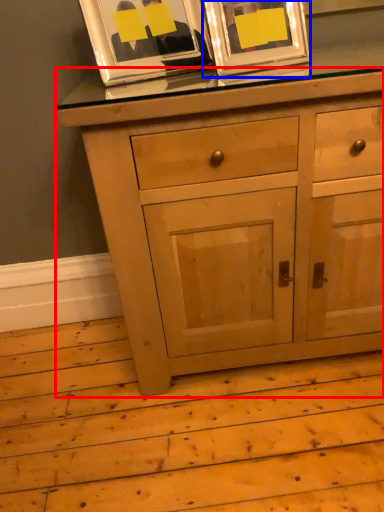
Question: Which of the following is the closest to the observer, chest of drawers (highlighted by a red box) or picture frame (highlighted by a blue box)?

Choices:
 (A) chest of drawers
 (B) picture frame

Answer: (A)